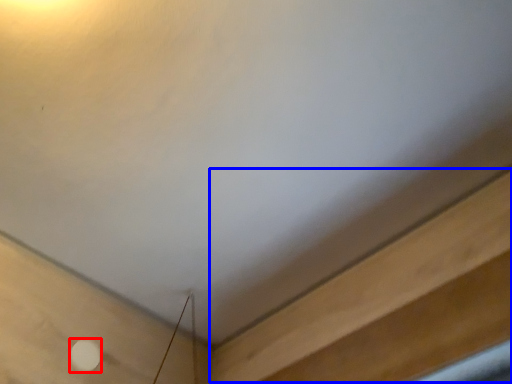
Question: Which of the following is the farthest to the observer, dot (highlighted by a red box) or plywood (highlighted by a blue box)?

Choices:
 (A) dot
 (B) plywood

Answer: (A)